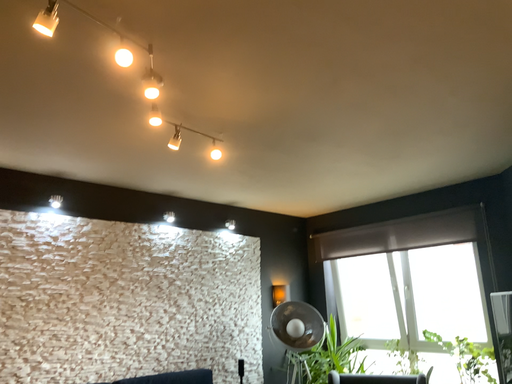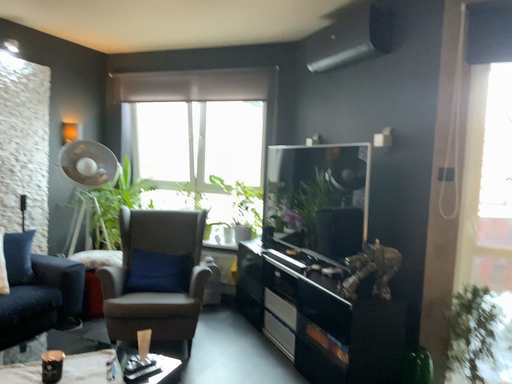
Question: How did the camera likely rotate when shooting the video?

Choices:
 (A) rotated left
 (B) rotated right

Answer: (B)